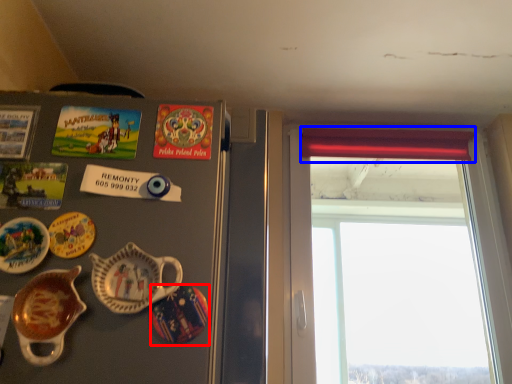
Question: Which point is closer to the camera, plate (highlighted by a red box) or curtain (highlighted by a blue box)?

Choices:
 (A) plate
 (B) curtain

Answer: (A)